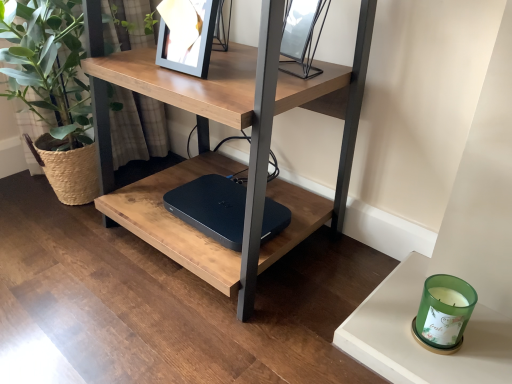
Question: Considering the relative sizes of black matte laptop at center and green glass candle at lower right in the image provided, is black matte laptop at center smaller than green glass candle at lower right?

Choices:
 (A) yes
 (B) no

Answer: (B)

Question: From the image's perspective, is black matte laptop at center over green glass candle at lower right?

Choices:
 (A) yes
 (B) no

Answer: (A)

Question: Would you consider black matte laptop at center to be distant from green glass candle at lower right?

Choices:
 (A) no
 (B) yes

Answer: (A)

Question: From a real-world perspective, is black matte laptop at center over green glass candle at lower right?

Choices:
 (A) yes
 (B) no

Answer: (A)

Question: Is black matte laptop at center positioned in front of green glass candle at lower right?

Choices:
 (A) no
 (B) yes

Answer: (A)

Question: Does black matte laptop at center turn towards green glass candle at lower right?

Choices:
 (A) yes
 (B) no

Answer: (B)

Question: Is green woven basket at left wider than green glass candle at lower right?

Choices:
 (A) no
 (B) yes

Answer: (B)

Question: Is green glass candle at lower right completely or partially inside green woven basket at left?

Choices:
 (A) yes
 (B) no

Answer: (B)

Question: Can you confirm if green woven basket at left is positioned to the left of green glass candle at lower right?

Choices:
 (A) no
 (B) yes

Answer: (B)

Question: From the image's perspective, does green woven basket at left appear lower than green glass candle at lower right?

Choices:
 (A) no
 (B) yes

Answer: (A)

Question: Could you tell me if green woven basket at left is turned towards green glass candle at lower right?

Choices:
 (A) yes
 (B) no

Answer: (B)

Question: Is green woven basket at left taller than green glass candle at lower right?

Choices:
 (A) yes
 (B) no

Answer: (A)

Question: Can you confirm if metallic silver picture frame at upper center is bigger than matte wood table at center?

Choices:
 (A) yes
 (B) no

Answer: (B)